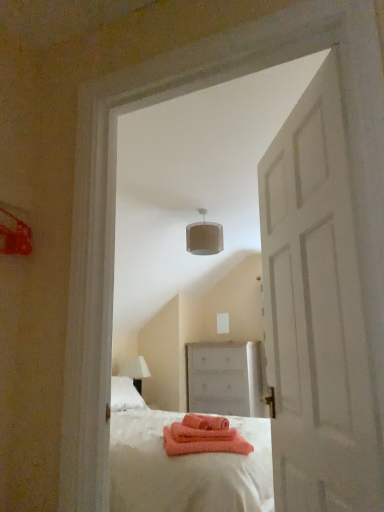
Question: From the image's perspective, is white matte door at center located beneath white matte chest of drawers at center?

Choices:
 (A) yes
 (B) no

Answer: (B)

Question: Is white matte door at center bigger than white matte chest of drawers at center?

Choices:
 (A) yes
 (B) no

Answer: (B)

Question: From a real-world perspective, is white matte door at center located higher than white matte chest of drawers at center?

Choices:
 (A) no
 (B) yes

Answer: (B)

Question: Does white matte door at center turn towards white matte chest of drawers at center?

Choices:
 (A) yes
 (B) no

Answer: (B)

Question: Does white matte door at center have a lesser height compared to white matte chest of drawers at center?

Choices:
 (A) no
 (B) yes

Answer: (A)

Question: Is white matte door at center next to white matte chest of drawers at center?

Choices:
 (A) no
 (B) yes

Answer: (A)

Question: Is white textured lampshade at upper center outside white fabric lampshade at left?

Choices:
 (A) no
 (B) yes

Answer: (B)

Question: From a real-world perspective, does white textured lampshade at upper center stand above white fabric lampshade at left?

Choices:
 (A) yes
 (B) no

Answer: (A)

Question: Is white textured lampshade at upper center surrounding white fabric lampshade at left?

Choices:
 (A) yes
 (B) no

Answer: (B)

Question: Is white textured lampshade at upper center at the right side of white fabric lampshade at left?

Choices:
 (A) yes
 (B) no

Answer: (A)

Question: Would you consider white textured lampshade at upper center to be distant from white fabric lampshade at left?

Choices:
 (A) yes
 (B) no

Answer: (A)

Question: Can you confirm if white textured lampshade at upper center is thinner than white fabric lampshade at left?

Choices:
 (A) no
 (B) yes

Answer: (B)

Question: Is white textured lampshade at upper center to the right of white matte door at center from the viewer's perspective?

Choices:
 (A) no
 (B) yes

Answer: (A)